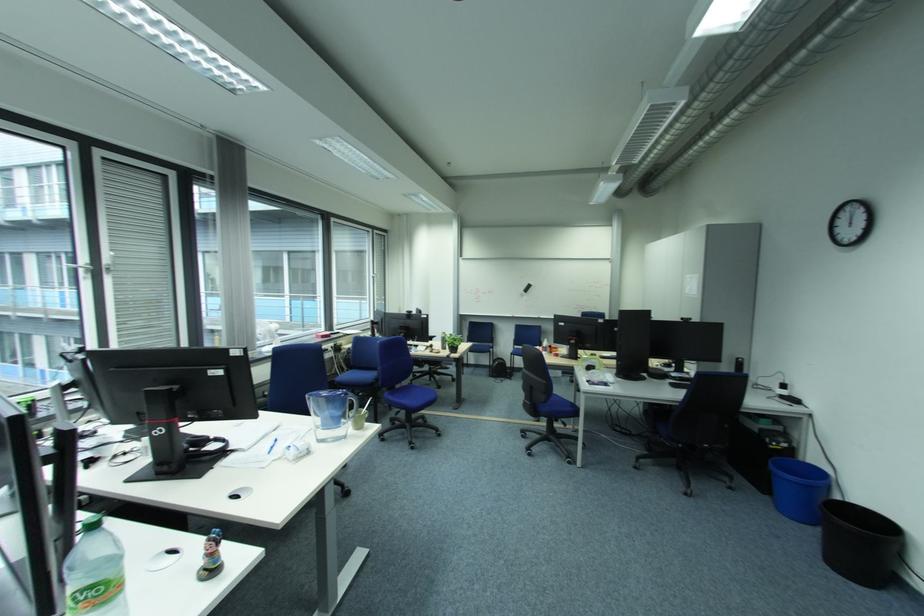
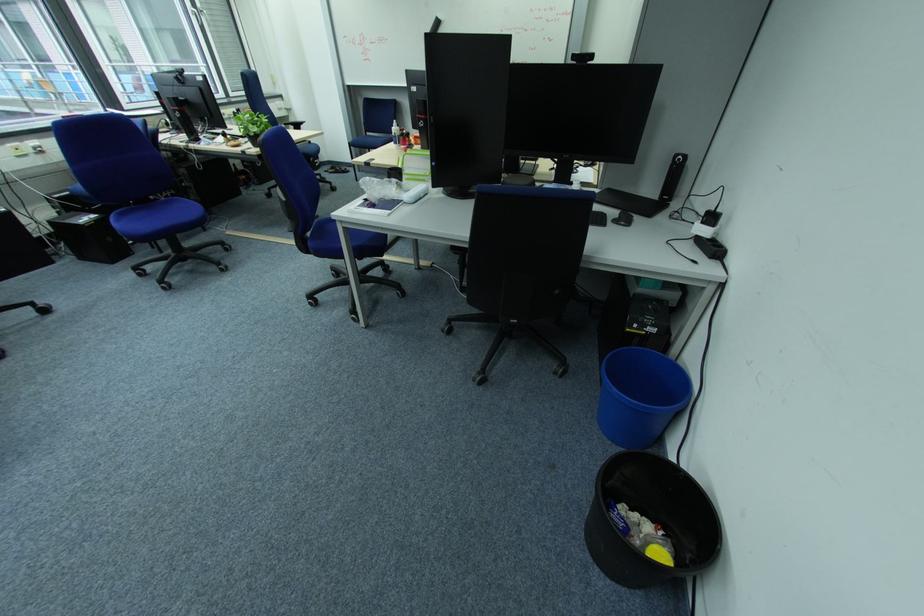
Locate, in the second image, the point that corresponds to the point at 691,320 in the first image.

(581, 57)